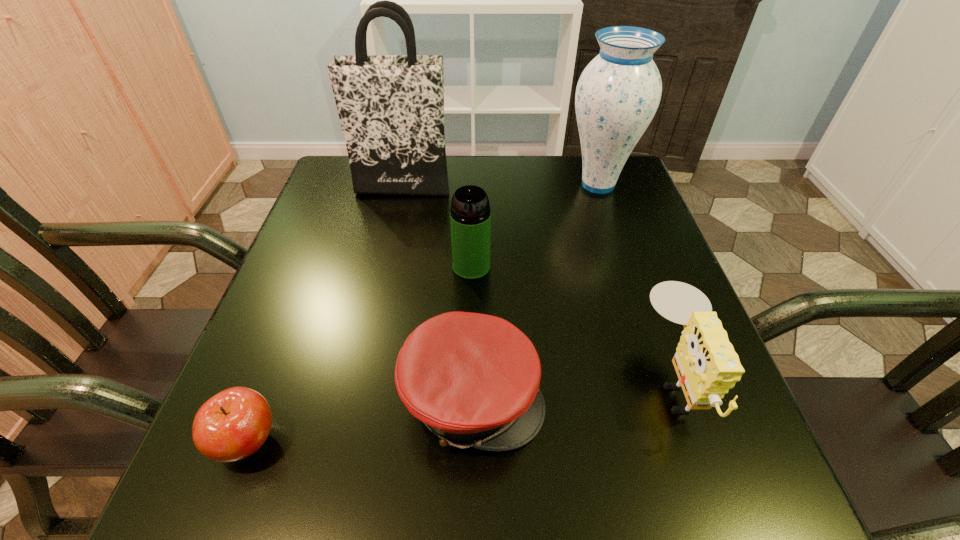
You are a GUI agent. You are given a task and a screenshot of the screen. Output one action in this format:
    pyautogui.click(x=<x>, y=<y>)
    Task: Click on the vacant region at the near left corner of the desktop
    The height and width of the screenshot is (540, 960).
    Given the screenshot: What is the action you would take?
    pyautogui.click(x=192, y=488)

You are a GUI agent. You are given a task and a screenshot of the screen. Output one action in this format:
    pyautogui.click(x=<x>, y=<y>)
    Task: Click on the vacant space that's between the sponge and the cap
    
    Given the screenshot: What is the action you would take?
    pyautogui.click(x=574, y=388)

Locate an element on the screen. unoccupied position between the shopping bag and the sponge is located at coordinates (539, 283).

Locate an element on the screen. vacant space that is in between the vase and the cap is located at coordinates (536, 291).

Where is `free area in between the apple and the shopping bag`? This screenshot has height=540, width=960. free area in between the apple and the shopping bag is located at coordinates (324, 313).

Locate an element on the screen. The image size is (960, 540). vacant space that is in between the third shortest object and the cap is located at coordinates (574, 388).

The width and height of the screenshot is (960, 540). Identify the location of unoccupied area between the apple and the vase. (422, 313).

In order to click on free spot between the cap and the vase in this screenshot , I will do `click(536, 291)`.

Locate an element on the screen. vacant area that lies between the fourth tallest object and the third tallest object is located at coordinates (573, 323).

You are a GUI agent. You are given a task and a screenshot of the screen. Output one action in this format:
    pyautogui.click(x=<x>, y=<y>)
    Task: Click on the vacant space in between the cap and the shopping bag
    
    Given the screenshot: What is the action you would take?
    pyautogui.click(x=438, y=291)